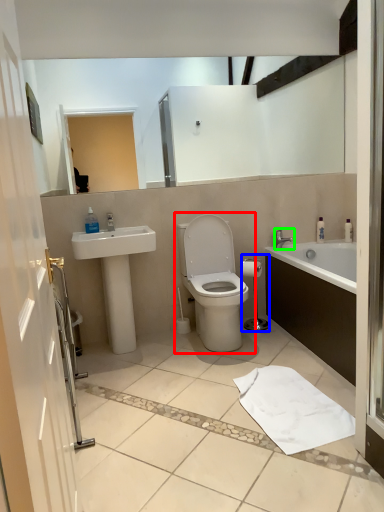
Question: Based on their relative distances, which object is nearer to toilet (highlighted by a red box)? Choose from shower (highlighted by a blue box) and tap (highlighted by a green box).

Choices:
 (A) shower
 (B) tap

Answer: (A)